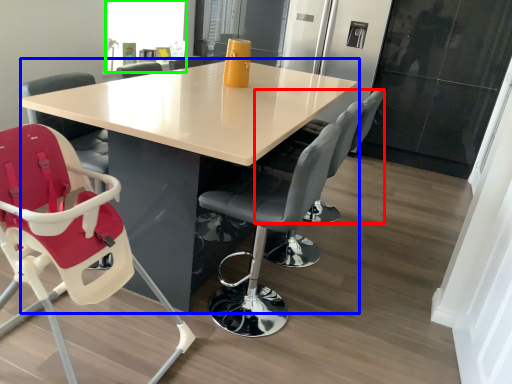
Question: Which object is the farthest from chair (highlighted by a red box)? Choose among these: table (highlighted by a blue box) or window screen (highlighted by a green box).

Choices:
 (A) table
 (B) window screen

Answer: (B)